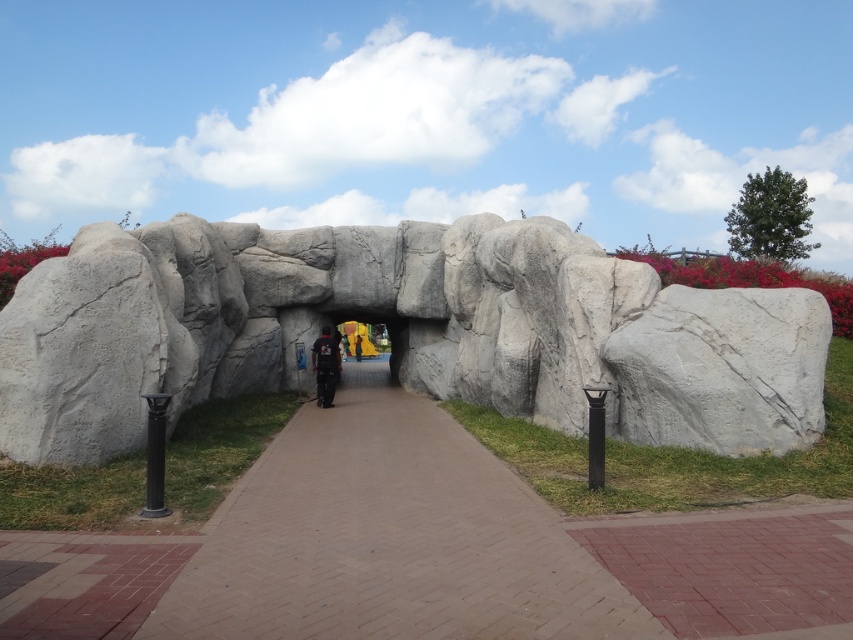
Who is positioned more to the right, brown brick path at center or black matte jacket at center?

From the viewer's perspective, brown brick path at center appears more on the right side.

Can you confirm if brown brick path at center is smaller than black matte jacket at center?

Actually, brown brick path at center might be larger than black matte jacket at center.

Does point (294, 416) lie in front of point (334, 340)?

Yes.

Where is `brown brick path at center`? Image resolution: width=853 pixels, height=640 pixels. brown brick path at center is located at coordinates pos(389,540).

Between white stone archway at center and brown brick path at center, which one has less height?

brown brick path at center

Is point (788, 371) behind point (563, 596)?

Yes, it is.

Where is `white stone archway at center`? The height and width of the screenshot is (640, 853). white stone archway at center is located at coordinates (399, 332).

Is point (567, 408) more distant than point (727, 424)?

Yes, point (567, 408) is farther from viewer.

Is white stone archway at center wider than gray rough boulder at right?

Yes, white stone archway at center is wider than gray rough boulder at right.

Does point (114, 435) lie behind point (727, 435)?

Yes.

The height and width of the screenshot is (640, 853). I want to click on white stone archway at center, so click(x=399, y=332).